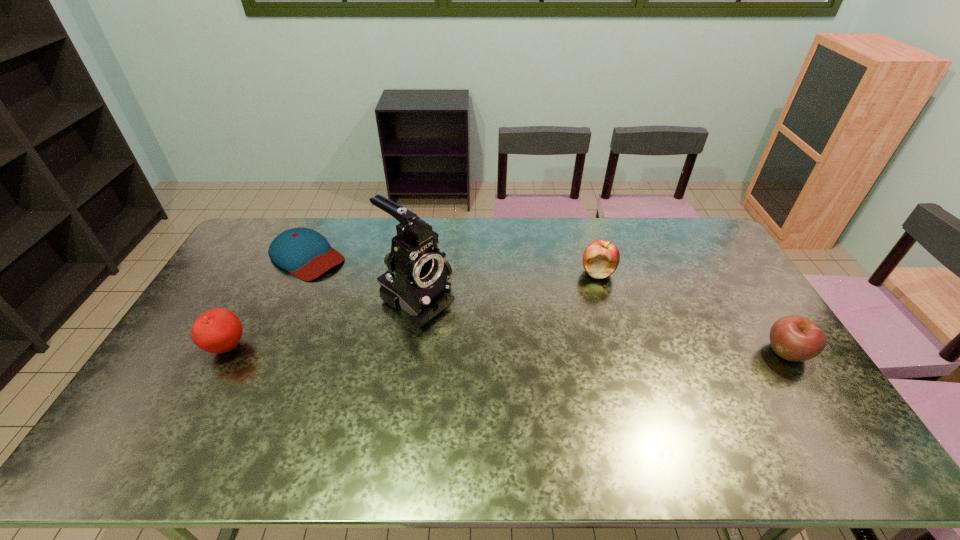
You are a GUI agent. You are given a task and a screenshot of the screen. Output one action in this format:
    pyautogui.click(x=<x>, y=<y>)
    Task: Click on the free space on the desktop that is between the leftmost apple and the fourth tallest object and is positioned on the bitten side of the second apple from left to right
    
    Given the screenshot: What is the action you would take?
    pyautogui.click(x=425, y=349)

Where is `free space on the desktop that is between the leftmost apple and the rightmost object and is positioned on the lens mount of the tallest object`? This screenshot has height=540, width=960. free space on the desktop that is between the leftmost apple and the rightmost object and is positioned on the lens mount of the tallest object is located at coordinates (486, 349).

Locate an element on the screen. Image resolution: width=960 pixels, height=540 pixels. vacant space on the desktop that is between the leftmost apple and the rightmost apple and is positioned with the bill of the baseball cap facing forward is located at coordinates (446, 349).